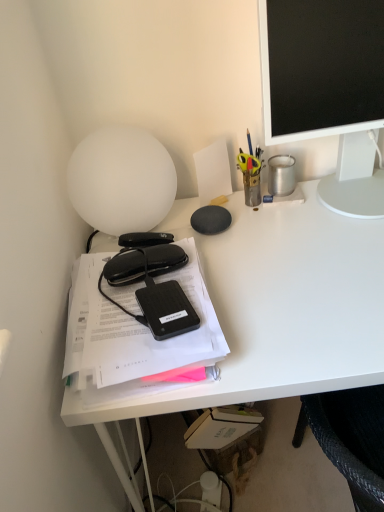
I want to click on free space between matte black monitor at upper right and black matte hardcover at left, so click(276, 264).